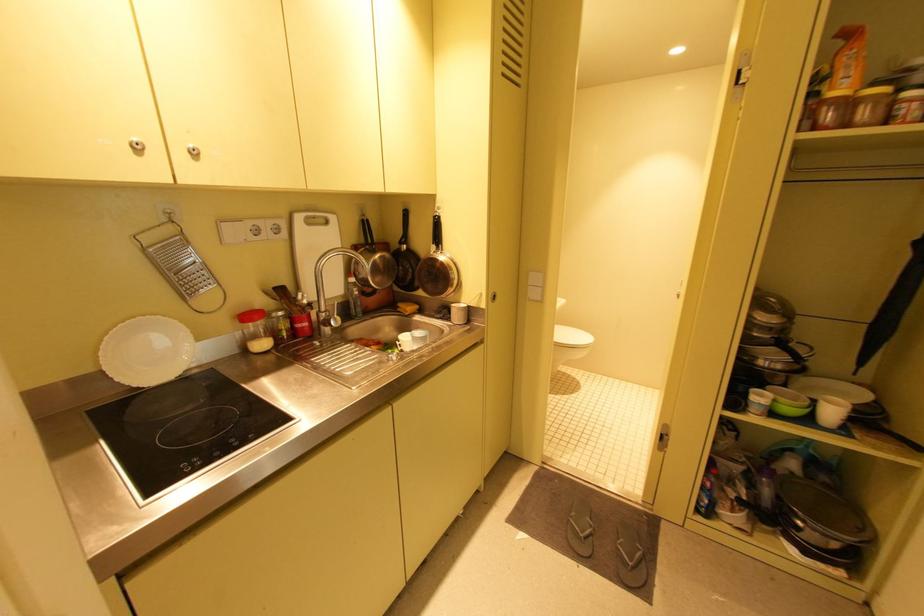
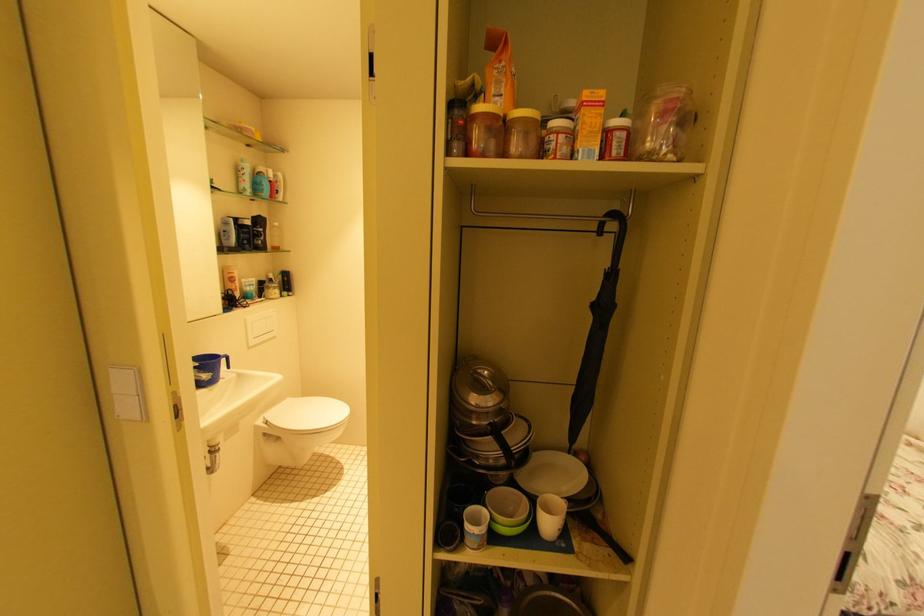
The images are taken continuously from a first-person perspective. In which direction are you moving?

The cameraman walked toward right, forward.